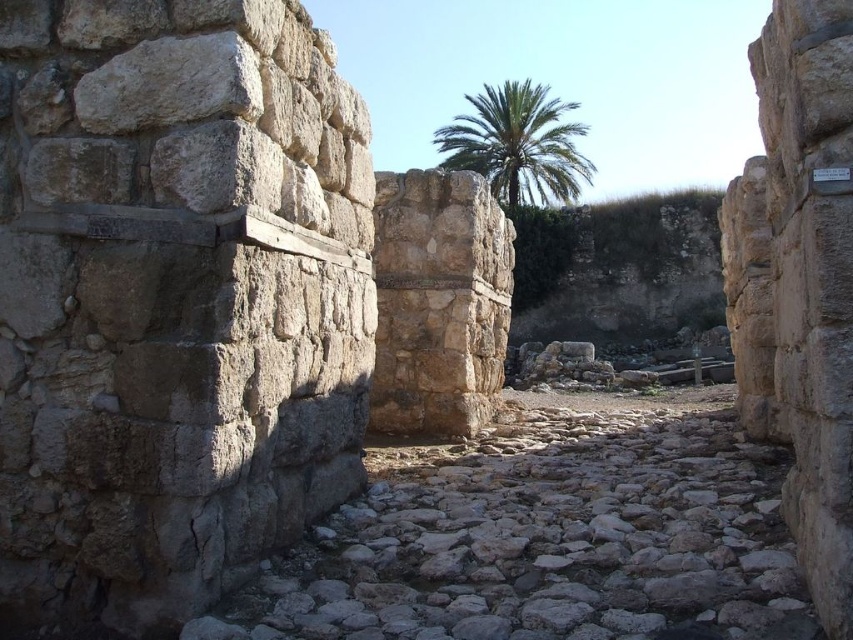
You are an archaeologist examining the ancient stone structure. You notice the gray stone wall at center and the green leafy palm at upper center. Which object appears narrower in the image?

The gray stone wall at center has a lesser width compared to the green leafy palm at upper center, so the gray stone wall at center appears narrower.